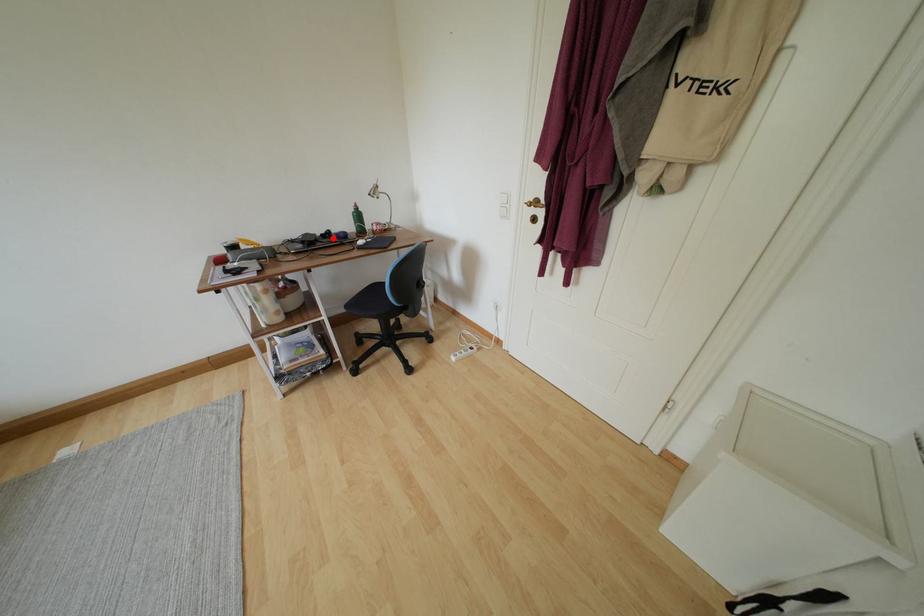
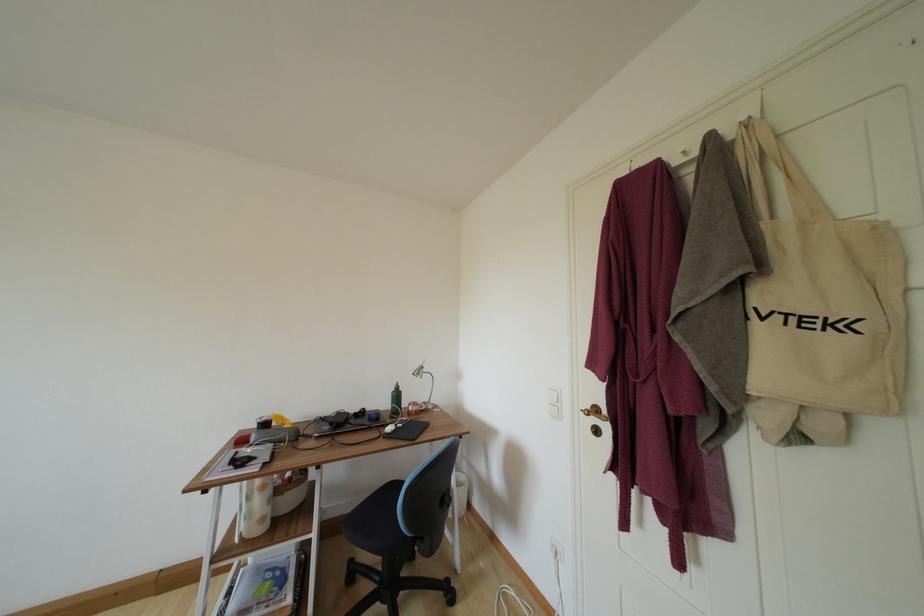
Where in the second image is the point corresponding to the highlighted location from the first image?

(367, 416)